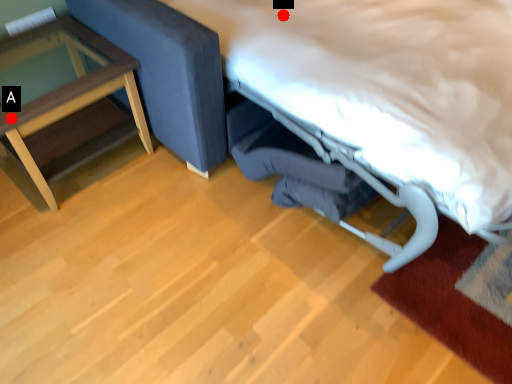
Question: Two points are circled on the image, labeled by A and B beside each circle. Which point appears farthest from the camera in this image?

Choices:
 (A) A is further
 (B) B is further

Answer: (B)